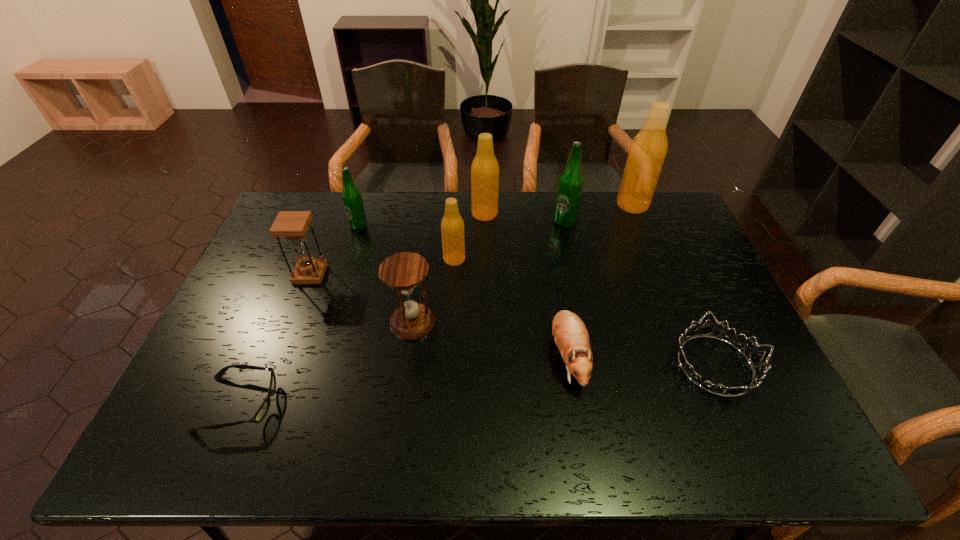
I want to click on the right hourglass, so click(x=404, y=272).

This screenshot has width=960, height=540. Identify the location of the nearer hourglass. (404, 272).

Identify the location of the left hourglass. The image size is (960, 540). (292, 225).

The image size is (960, 540). I want to click on brown hamster, so click(570, 334).

The image size is (960, 540). What are the coordinates of `the eighth tallest object` in the screenshot? It's located at pyautogui.click(x=570, y=334).

Locate an element on the screen. the second shortest object is located at coordinates (755, 358).

Locate an element on the screen. the shortest object is located at coordinates (264, 408).

In order to click on vacant position located on the front of the tallest object in this screenshot , I will do `click(666, 287)`.

You are a GUI agent. You are given a task and a screenshot of the screen. Output one action in this format:
    pyautogui.click(x=<x>, y=<y>)
    Task: Click on the free space located on the front of the fifth object from right to left
    The height and width of the screenshot is (540, 960).
    Given the screenshot: What is the action you would take?
    pyautogui.click(x=486, y=308)

Find the location of a particular element. This screenshot has height=540, width=960. free space located on the label of the bigger green beer bottle is located at coordinates (570, 246).